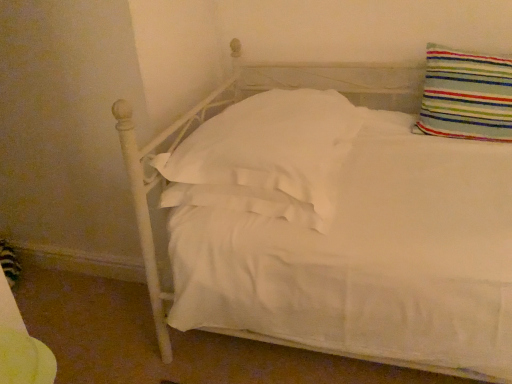
Question: Does striped fabric pillow at upper right, the 1th pillow viewed from the right, have a smaller size compared to white soft pillow at center, the first pillow positioned from the left?

Choices:
 (A) no
 (B) yes

Answer: (B)

Question: Would you say striped fabric pillow at upper right, the 1th pillow viewed from the right, is outside white soft pillow at center, the first pillow positioned from the left?

Choices:
 (A) no
 (B) yes

Answer: (B)

Question: Does striped fabric pillow at upper right, the second pillow positioned from the left, contain white soft pillow at center, which ranks as the second pillow in right-to-left order?

Choices:
 (A) yes
 (B) no

Answer: (B)

Question: Considering the relative sizes of striped fabric pillow at upper right, the 1th pillow viewed from the right, and white soft pillow at center, which ranks as the second pillow in right-to-left order, in the image provided, is striped fabric pillow at upper right, the 1th pillow viewed from the right, thinner than white soft pillow at center, which ranks as the second pillow in right-to-left order,?

Choices:
 (A) yes
 (B) no

Answer: (A)

Question: Can you confirm if striped fabric pillow at upper right, the 1th pillow viewed from the right, is positioned to the left of white soft pillow at center, the first pillow positioned from the left?

Choices:
 (A) yes
 (B) no

Answer: (B)

Question: Does white soft pillow at center, the first pillow positioned from the left, have a greater height compared to striped fabric pillow at upper right, the 1th pillow viewed from the right?

Choices:
 (A) no
 (B) yes

Answer: (A)

Question: Is white soft pillow at center, the first pillow positioned from the left, in contact with striped fabric pillow at upper right, the second pillow positioned from the left?

Choices:
 (A) yes
 (B) no

Answer: (B)

Question: Does white soft pillow at center, which ranks as the second pillow in right-to-left order, have a greater width compared to striped fabric pillow at upper right, the 1th pillow viewed from the right?

Choices:
 (A) yes
 (B) no

Answer: (A)

Question: Is white soft pillow at center, the first pillow positioned from the left, oriented towards striped fabric pillow at upper right, the 1th pillow viewed from the right?

Choices:
 (A) no
 (B) yes

Answer: (A)

Question: Is white soft pillow at center, which ranks as the second pillow in right-to-left order, further to camera compared to striped fabric pillow at upper right, the 1th pillow viewed from the right?

Choices:
 (A) no
 (B) yes

Answer: (A)

Question: Is white soft pillow at center, the first pillow positioned from the left, not within striped fabric pillow at upper right, the second pillow positioned from the left?

Choices:
 (A) yes
 (B) no

Answer: (A)

Question: Relative to white soft pillow at center, which ranks as the second pillow in right-to-left order, is striped fabric pillow at upper right, the 1th pillow viewed from the right, in front or behind?

Choices:
 (A) front
 (B) behind

Answer: (B)